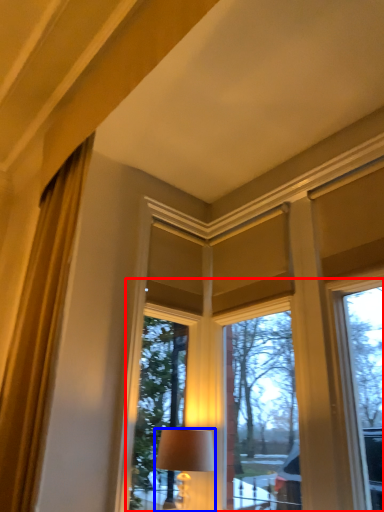
Question: Which of the following is the closest to the observer, bay window (highlighted by a red box) or lamp (highlighted by a blue box)?

Choices:
 (A) bay window
 (B) lamp

Answer: (A)